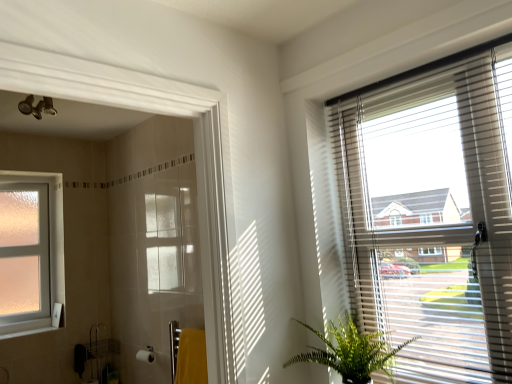
Question: Is white glossy shower door at left facing towards white plastic window sill at lower left?

Choices:
 (A) yes
 (B) no

Answer: (B)

Question: Does white glossy shower door at left have a larger size compared to white plastic window sill at lower left?

Choices:
 (A) yes
 (B) no

Answer: (A)

Question: Does white glossy shower door at left have a lesser height compared to white plastic window sill at lower left?

Choices:
 (A) no
 (B) yes

Answer: (A)

Question: Can you confirm if white glossy shower door at left is wider than white plastic window sill at lower left?

Choices:
 (A) no
 (B) yes

Answer: (A)

Question: Considering the relative positions of white glossy shower door at left and white plastic window sill at lower left in the image provided, is white glossy shower door at left to the left of white plastic window sill at lower left from the viewer's perspective?

Choices:
 (A) no
 (B) yes

Answer: (A)

Question: Relative to frosted glass window at left, is yellow fabric towel at lower center in front or behind?

Choices:
 (A) behind
 (B) front

Answer: (B)

Question: From the image's perspective, is yellow fabric towel at lower center located above or below frosted glass window at left?

Choices:
 (A) above
 (B) below

Answer: (B)

Question: Is yellow fabric towel at lower center inside the boundaries of frosted glass window at left, or outside?

Choices:
 (A) inside
 (B) outside

Answer: (B)

Question: From a real-world perspective, relative to frosted glass window at left, is yellow fabric towel at lower center vertically above or below?

Choices:
 (A) above
 (B) below

Answer: (B)

Question: From the image's perspective, is white glossy shower door at left located above or below yellow fabric towel at lower center?

Choices:
 (A) below
 (B) above

Answer: (B)

Question: Is white glossy shower door at left to the left or to the right of yellow fabric towel at lower center in the image?

Choices:
 (A) left
 (B) right

Answer: (A)

Question: Considering the positions of white glossy shower door at left and yellow fabric towel at lower center in the image, is white glossy shower door at left bigger or smaller than yellow fabric towel at lower center?

Choices:
 (A) big
 (B) small

Answer: (A)

Question: Considering their positions, is white glossy shower door at left located in front of or behind yellow fabric towel at lower center?

Choices:
 (A) behind
 (B) front

Answer: (B)

Question: Which is correct: yellow fabric towel at lower center is inside white glossy shower door at left, or outside of it?

Choices:
 (A) inside
 (B) outside

Answer: (B)

Question: Is point (197, 359) positioned closer to the camera than point (219, 152)?

Choices:
 (A) closer
 (B) farther

Answer: (B)